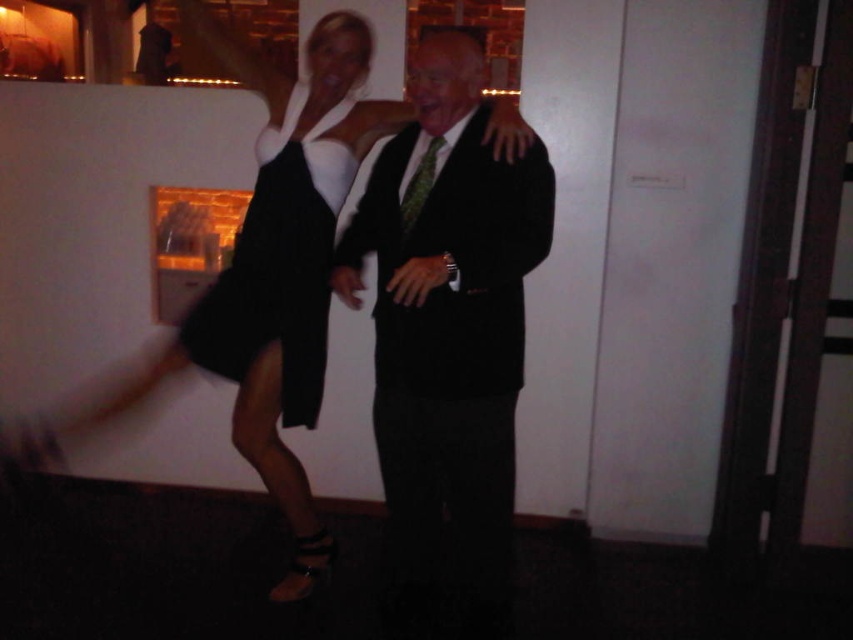
Consider the image. Between black matte suit at center and green textured tie at center, which one has less height?

green textured tie at center is shorter.

Can you confirm if black matte suit at center is taller than green textured tie at center?

Yes, black matte suit at center is taller than green textured tie at center.

The width and height of the screenshot is (853, 640). What do you see at coordinates (448, 324) in the screenshot?
I see `black matte suit at center` at bounding box center [448, 324].

This screenshot has height=640, width=853. In order to click on black matte suit at center in this screenshot , I will do `click(448, 324)`.

Is point (408, 579) closer to viewer compared to point (347, 29)?

No, (408, 579) is behind (347, 29).

How much distance is there between black matte suit at center and black satin dress at center?

A distance of 16.62 inches exists between black matte suit at center and black satin dress at center.

What do you see at coordinates (448, 324) in the screenshot? I see `black matte suit at center` at bounding box center [448, 324].

Find the location of a particular element. This screenshot has height=640, width=853. black matte suit at center is located at coordinates (448, 324).

Is black satin dress at center behind black matte dress at center?

That is False.

Does point (252, 449) come behind point (219, 358)?

Yes, it is.

Image resolution: width=853 pixels, height=640 pixels. What do you see at coordinates (271, 273) in the screenshot?
I see `black satin dress at center` at bounding box center [271, 273].

Locate an element on the screen. This screenshot has width=853, height=640. black satin dress at center is located at coordinates (271, 273).